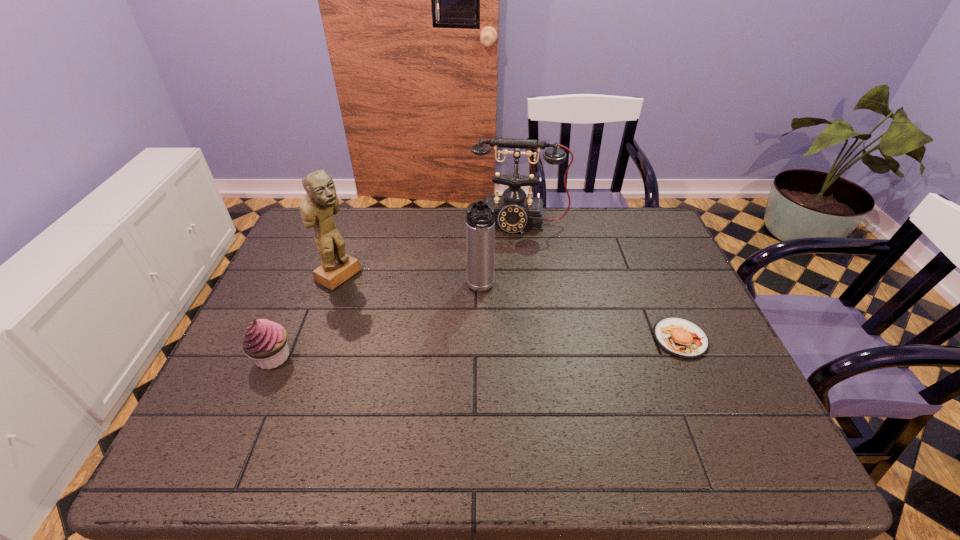
The height and width of the screenshot is (540, 960). In order to click on the fourth tallest object in this screenshot , I will do `click(265, 341)`.

Where is `patty`? This screenshot has width=960, height=540. patty is located at coordinates (680, 337).

Where is `the rightmost object`? the rightmost object is located at coordinates (680, 337).

Identify the location of the farthest object. The height and width of the screenshot is (540, 960). click(x=514, y=212).

The image size is (960, 540). In order to click on figurine in this screenshot , I will do `click(318, 206)`.

Where is `thermos bottle`? The width and height of the screenshot is (960, 540). thermos bottle is located at coordinates (480, 219).

Locate an element on the screen. Image resolution: width=960 pixels, height=540 pixels. vacant space located 0.100m on the front of the fourth tallest object is located at coordinates (249, 413).

Locate an element on the screen. free space located 0.370m on the left of the rightmost object is located at coordinates (504, 339).

Find the location of a particular element. The image size is (960, 540). free space located on the dial of the farthest object is located at coordinates (510, 305).

Where is `vacant space located 0.210m on the dial of the farthest object`? vacant space located 0.210m on the dial of the farthest object is located at coordinates (512, 280).